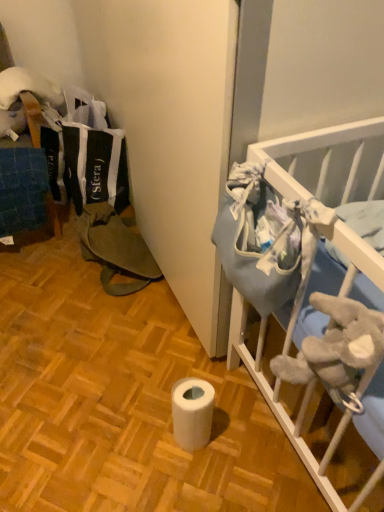
Locate an element on the screen. This screenshot has width=384, height=512. space that is in front of white matte toilet paper at center is located at coordinates (192, 483).